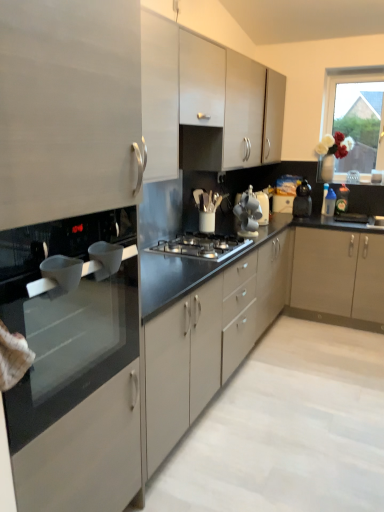
Question: From a real-world perspective, is black plastic kettle at right located higher than white ceramic cups at center, placed as the 2th appliance when sorted from left to right?

Choices:
 (A) no
 (B) yes

Answer: (A)

Question: Would you say black plastic kettle at right is outside white ceramic cups at center, which is the second appliance in back-to-front order?

Choices:
 (A) no
 (B) yes

Answer: (B)

Question: Does black plastic kettle at right turn towards white ceramic cups at center, the 2th appliance positioned from the front?

Choices:
 (A) yes
 (B) no

Answer: (A)

Question: Is black plastic kettle at right touching white ceramic cups at center, placed as the 2th appliance when sorted from left to right?

Choices:
 (A) no
 (B) yes

Answer: (A)

Question: From a real-world perspective, is black plastic kettle at right positioned under white ceramic cups at center, the 2th appliance positioned from the front, based on gravity?

Choices:
 (A) no
 (B) yes

Answer: (B)

Question: Looking at the image, does white ceramic cups at center, which is the second appliance in back-to-front order, seem bigger or smaller compared to black glass stove at left, the second countertop from the back?

Choices:
 (A) big
 (B) small

Answer: (B)

Question: Considering the relative positions of white ceramic cups at center, the 2th appliance positioned from the front, and black glass stove at left, the first countertop when ordered from front to back, in the image provided, is white ceramic cups at center, the 2th appliance positioned from the front, to the left or to the right of black glass stove at left, the first countertop when ordered from front to back,?

Choices:
 (A) right
 (B) left

Answer: (A)

Question: From a real-world perspective, is white ceramic cups at center, placed as the 2th appliance when sorted from left to right, above or below black glass stove at left, the second countertop from the back?

Choices:
 (A) below
 (B) above

Answer: (B)

Question: In terms of width, does white ceramic cups at center, the 2th appliance positioned from the front, look wider or thinner when compared to black glass stove at left, the first countertop when ordered from front to back?

Choices:
 (A) wide
 (B) thin

Answer: (B)

Question: Is black plastic kettle at right wider or thinner than black matte countertop at center, which ranks as the 2th countertop in front-to-back order?

Choices:
 (A) wide
 (B) thin

Answer: (B)

Question: In terms of height, does black plastic kettle at right look taller or shorter compared to black matte countertop at center, which ranks as the first countertop in back-to-front order?

Choices:
 (A) tall
 (B) short

Answer: (B)

Question: Is point (301, 200) positioned closer to the camera than point (342, 263)?

Choices:
 (A) closer
 (B) farther

Answer: (B)

Question: Which is correct: black plastic kettle at right is inside black matte countertop at center, which ranks as the first countertop in back-to-front order, or outside of it?

Choices:
 (A) outside
 (B) inside

Answer: (A)

Question: From their relative heights in the image, would you say white glossy cup at left, placed as the 1th appliance when sorted from front to back, is taller or shorter than black glass stove at left, the second countertop from the back?

Choices:
 (A) short
 (B) tall

Answer: (A)

Question: Relative to black glass stove at left, the second countertop from the back, is white glossy cup at left, placed as the third appliance when sorted from right to left, in front or behind?

Choices:
 (A) behind
 (B) front

Answer: (A)